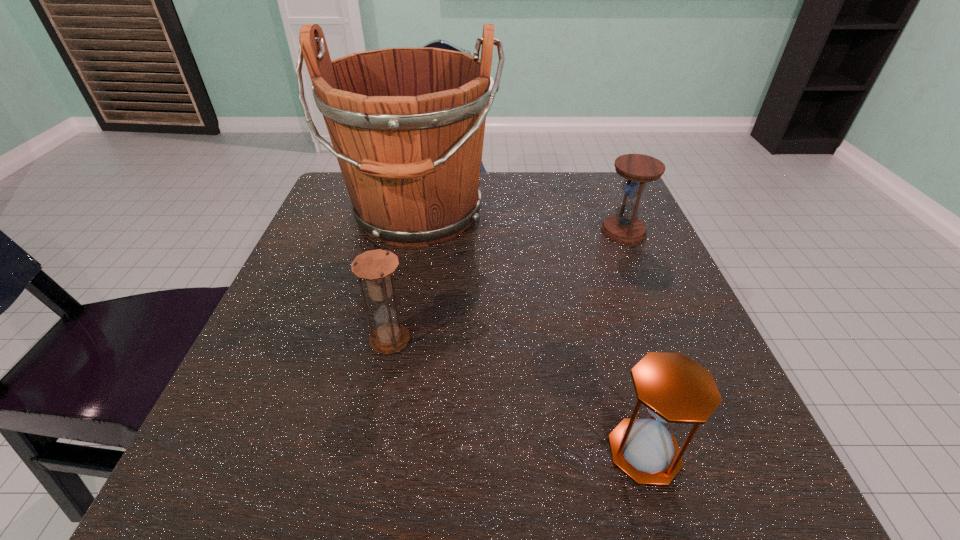
Locate an element on the screen. This screenshot has height=540, width=960. free space at the left edge is located at coordinates (284, 370).

Locate an element on the screen. vacant space at the right edge of the desktop is located at coordinates (674, 274).

I want to click on free spot between the tallest object and the nearest hourglass, so click(x=531, y=334).

Locate an element on the screen. vacant point located between the nearest object and the bucket is located at coordinates (531, 334).

Where is `empty location between the tallest object and the leftmost hourglass`? This screenshot has height=540, width=960. empty location between the tallest object and the leftmost hourglass is located at coordinates (404, 278).

I want to click on free space between the rightmost hourglass and the second hourglass from left to right, so click(634, 341).

Image resolution: width=960 pixels, height=540 pixels. What are the coordinates of `empty space that is in between the second nearest hourglass and the rightmost hourglass` in the screenshot? It's located at pyautogui.click(x=507, y=286).

This screenshot has height=540, width=960. What are the coordinates of `empty location between the nearest hourglass and the leftmost hourglass` in the screenshot? It's located at (517, 396).

Find the location of a particular element. This screenshot has width=960, height=540. vacant space that is in between the third farthest object and the second hourglass from left to right is located at coordinates (517, 396).

Where is `free space between the bucket and the rightmost hourglass`? The height and width of the screenshot is (540, 960). free space between the bucket and the rightmost hourglass is located at coordinates (520, 223).